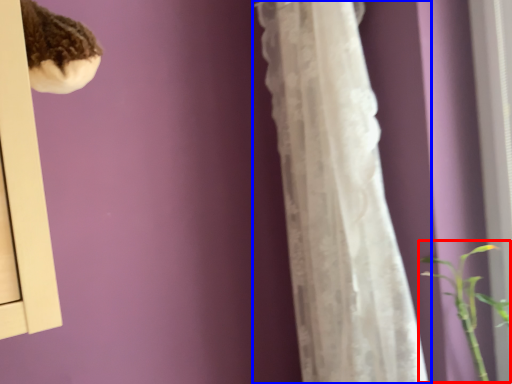
Question: Which of the following is the farthest to the observer, orchid (highlighted by a red box) or curtain (highlighted by a blue box)?

Choices:
 (A) orchid
 (B) curtain

Answer: (A)